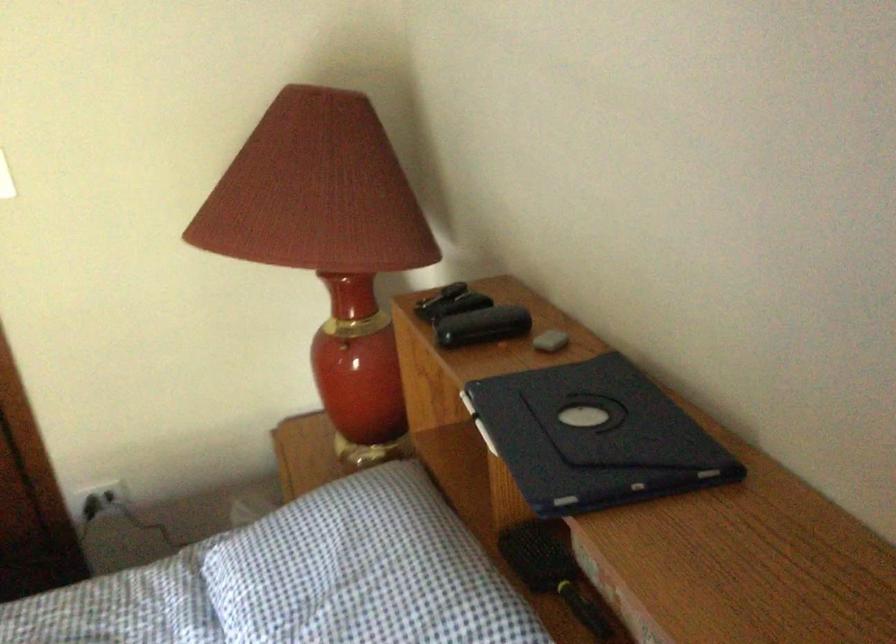
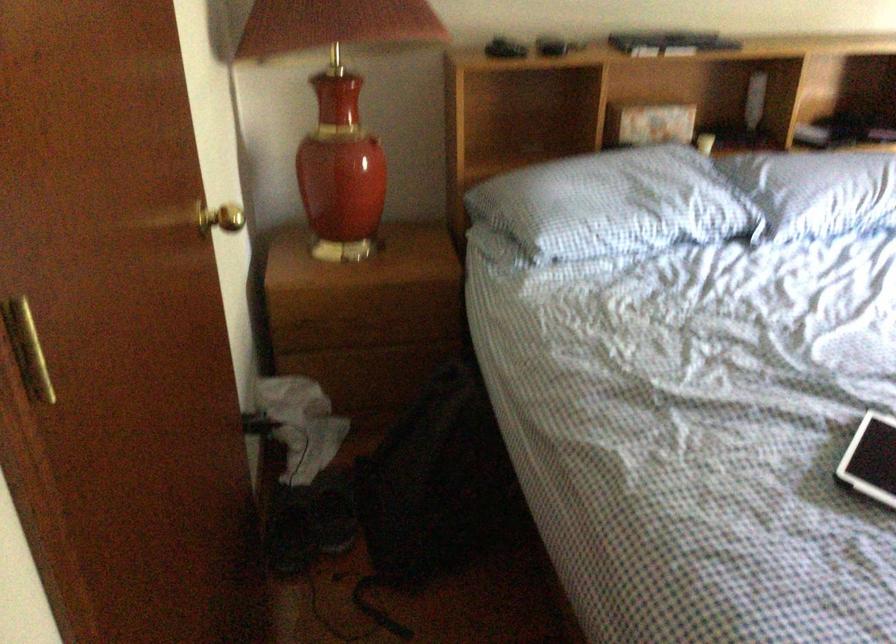
Question: I am providing you with two images of the same scene from different viewpoints. After the viewpoint changes to image2, which objects are now occluded?

Choices:
 (A) gold door knob
 (B) wall outlet
 (C) speaker control knob
 (D) blue checkered pillow

Answer: (B)